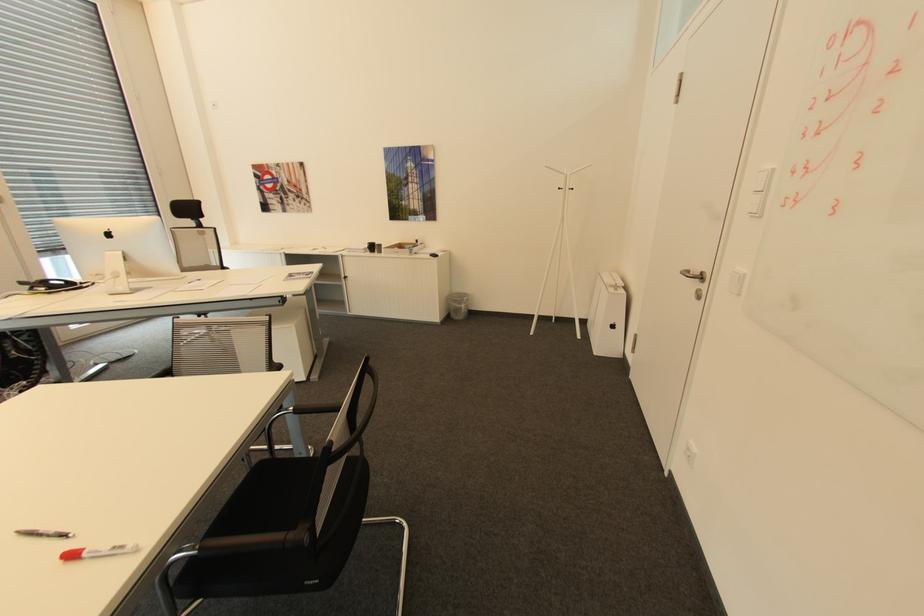
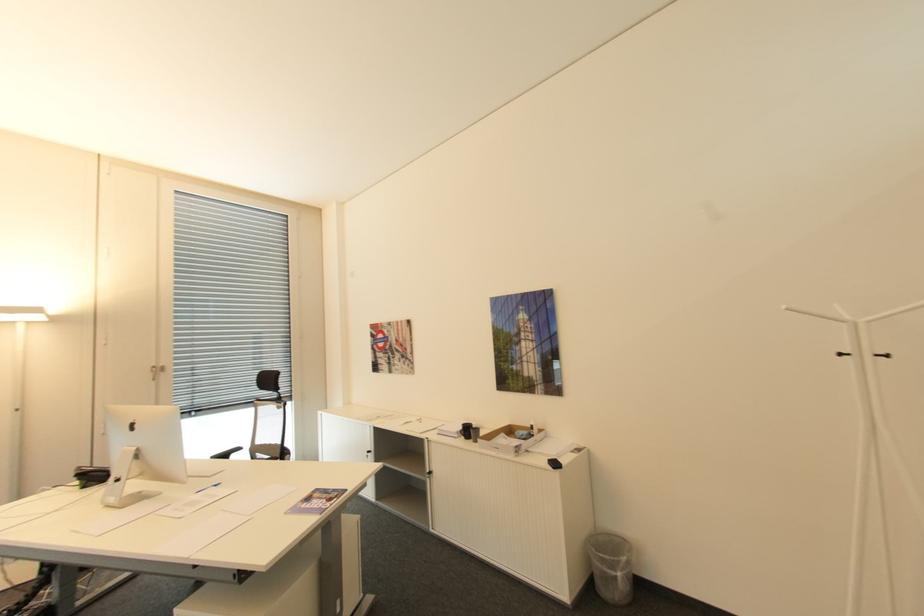
Where in the second image is the point corresponding to (x=549, y=164) from the first image?

(791, 307)